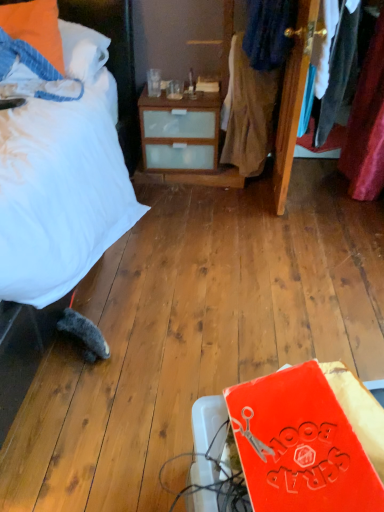
Locate an element on the screen. Image resolution: width=384 pixels, height=512 pixels. rubberized orange book at lower right is located at coordinates (309, 440).

Describe the element at coordinates (114, 55) in the screenshot. Image resolution: width=384 pixels, height=512 pixels. I see `white soft bed at left` at that location.

Locate an element on the screen. orange fabric pillow at upper left is located at coordinates (35, 27).

At what (x,y) coordinates should I click in order to perform the action: click on rubberized orange book at lower right. Please return your answer as a coordinate pair (x, y). The height and width of the screenshot is (512, 384). Looking at the image, I should click on tap(309, 440).

From a real-world perspective, is dark blue fabric at upper right, the second clothing from the top, located higher than denim jacket at upper right, acting as the 2th clothing starting from the bottom?

No, from a real-world perspective, dark blue fabric at upper right, the second clothing from the top, is not over denim jacket at upper right, acting as the 2th clothing starting from the bottom

Is denim jacket at upper right, which is the first clothing from top to bottom, completely or partially inside dark blue fabric at upper right, which ranks as the 1th clothing in bottom-to-top order?

Absolutely, denim jacket at upper right, which is the first clothing from top to bottom, is inside dark blue fabric at upper right, which ranks as the 1th clothing in bottom-to-top order.

Between point (260, 88) and point (277, 27), which one is positioned behind?

The point (260, 88) is more distant.

Is point (363, 416) more distant than point (262, 162)?

That is False.

Which object is thinner, rubberized orange book at lower right or dark blue fabric at upper right, which ranks as the 1th clothing in bottom-to-top order?

rubberized orange book at lower right.

Can you see rubberized orange book at lower right touching dark blue fabric at upper right, the second clothing from the top?

rubberized orange book at lower right and dark blue fabric at upper right, the second clothing from the top, are clearly separated.

Based on the photo, does white soft bed at left have a greater height compared to rubberized orange book at lower right?

Correct, white soft bed at left is much taller as rubberized orange book at lower right.

Does point (63, 7) come farther from viewer compared to point (258, 498)?

Yes, point (63, 7) is behind point (258, 498).

How distant is white soft bed at left from rubberized orange book at lower right?

white soft bed at left and rubberized orange book at lower right are 5.68 feet apart.

Is white soft bed at left next to rubberized orange book at lower right and touching it?

No, white soft bed at left is not in contact with rubberized orange book at lower right.

Can you confirm if orange fabric pillow at upper left is bigger than white soft bed at left?

No.

How much distance is there between orange fabric pillow at upper left and white soft bed at left?

They are 6.39 inches apart.

Is orange fabric pillow at upper left facing away from white soft bed at left?

Correct, orange fabric pillow at upper left is looking away from white soft bed at left.

From a real-world perspective, which object rests below the other?

white soft bed at left is physically lower.

Which is in front, point (134, 116) or point (234, 45)?

The point (234, 45) is closer to the camera.

From a real-world perspective, is white soft bed at left under dark blue fabric at upper right, which ranks as the 1th clothing in bottom-to-top order?

Yes, from a real-world perspective, white soft bed at left is under dark blue fabric at upper right, which ranks as the 1th clothing in bottom-to-top order.

In the scene shown: Does white soft bed at left touch dark blue fabric at upper right, which ranks as the 1th clothing in bottom-to-top order?

white soft bed at left and dark blue fabric at upper right, which ranks as the 1th clothing in bottom-to-top order, are clearly separated.

This screenshot has width=384, height=512. I want to click on the 1st clothing to the right of the white soft bed at left, counting from the anchor's position, so click(x=248, y=112).

Between denim jacket at upper right, acting as the 2th clothing starting from the bottom, and rubberized orange book at lower right, which one has more height?

denim jacket at upper right, acting as the 2th clothing starting from the bottom.

Does denim jacket at upper right, acting as the 2th clothing starting from the bottom, have a greater width compared to rubberized orange book at lower right?

Yes.

Is denim jacket at upper right, acting as the 2th clothing starting from the bottom, turned away from rubberized orange book at lower right?

That's not correct — denim jacket at upper right, acting as the 2th clothing starting from the bottom, is not looking away from rubberized orange book at lower right.

In the image, is denim jacket at upper right, which is the first clothing from top to bottom, positioned in front of or behind rubberized orange book at lower right?

Clearly, denim jacket at upper right, which is the first clothing from top to bottom, is behind rubberized orange book at lower right.

From the image's perspective, is denim jacket at upper right, which is the first clothing from top to bottom, under orange fabric pillow at upper left?

No, from the image's perspective, denim jacket at upper right, which is the first clothing from top to bottom, is not beneath orange fabric pillow at upper left.

Who is smaller, denim jacket at upper right, acting as the 2th clothing starting from the bottom, or orange fabric pillow at upper left?

denim jacket at upper right, acting as the 2th clothing starting from the bottom.

Locate an element on the screen. clothing above the orange fabric pillow at upper left (from the image's perspective) is located at coordinates (269, 32).

Does denim jacket at upper right, which is the first clothing from top to bottom, contain orange fabric pillow at upper left?

No.

At what (x,y) coordinates should I click in order to perform the action: click on clothing above the dark blue fabric at upper right, the second clothing from the top (from a real-world perspective). Please return your answer as a coordinate pair (x, y). Image resolution: width=384 pixels, height=512 pixels. Looking at the image, I should click on (269, 32).

At what (x,y) coordinates should I click in order to perform the action: click on book below the dark blue fabric at upper right, which ranks as the 1th clothing in bottom-to-top order (from a real-world perspective). Please return your answer as a coordinate pair (x, y). Looking at the image, I should click on (309, 440).

Based on the photo, which object lies further to the anchor point orange fabric pillow at upper left, rubberized orange book at lower right or denim jacket at upper right, acting as the 2th clothing starting from the bottom?

rubberized orange book at lower right lies further to orange fabric pillow at upper left than the other object.

From the image, which object appears to be nearer to orange fabric pillow at upper left, dark blue fabric at upper right, the second clothing from the top, or white soft bed at left?

white soft bed at left lies closer to orange fabric pillow at upper left than the other object.

Considering their positions, is dark blue fabric at upper right, the second clothing from the top, positioned further to white soft bed at left than denim jacket at upper right, acting as the 2th clothing starting from the bottom?

denim jacket at upper right, acting as the 2th clothing starting from the bottom, is further to white soft bed at left.

Consider the image. When comparing their distances from rubberized orange book at lower right, does white soft bed at left or denim jacket at upper right, which is the first clothing from top to bottom, seem closer?

denim jacket at upper right, which is the first clothing from top to bottom.

Considering their positions, is white soft bed at left positioned closer to dark blue fabric at upper right, which ranks as the 1th clothing in bottom-to-top order, than rubberized orange book at lower right?

white soft bed at left is positioned closer to the anchor dark blue fabric at upper right, which ranks as the 1th clothing in bottom-to-top order.

From the image, which object appears to be nearer to rubberized orange book at lower right, orange fabric pillow at upper left or dark blue fabric at upper right, which ranks as the 1th clothing in bottom-to-top order?

The object closer to rubberized orange book at lower right is dark blue fabric at upper right, which ranks as the 1th clothing in bottom-to-top order.

When comparing their distances from dark blue fabric at upper right, which ranks as the 1th clothing in bottom-to-top order, does orange fabric pillow at upper left or white soft bed at left seem closer?

Among the two, white soft bed at left is located nearer to dark blue fabric at upper right, which ranks as the 1th clothing in bottom-to-top order.

In the scene shown: From the image, which object appears to be farther from dark blue fabric at upper right, the second clothing from the top, white soft bed at left or denim jacket at upper right, acting as the 2th clothing starting from the bottom?

white soft bed at left.

Where is `bed between denim jacket at upper right, acting as the 2th clothing starting from the bottom, and rubberized orange book at lower right in the up-down direction`? Image resolution: width=384 pixels, height=512 pixels. bed between denim jacket at upper right, acting as the 2th clothing starting from the bottom, and rubberized orange book at lower right in the up-down direction is located at coordinates (114, 55).

Where is `pillow between denim jacket at upper right, which is the first clothing from top to bottom, and rubberized orange book at lower right in the up-down direction`? The width and height of the screenshot is (384, 512). pillow between denim jacket at upper right, which is the first clothing from top to bottom, and rubberized orange book at lower right in the up-down direction is located at coordinates (35, 27).

This screenshot has height=512, width=384. I want to click on book positioned between white soft bed at left and dark blue fabric at upper right, the second clothing from the top, from near to far, so click(309, 440).

I want to click on clothing that lies between orange fabric pillow at upper left and rubberized orange book at lower right from top to bottom, so click(248, 112).